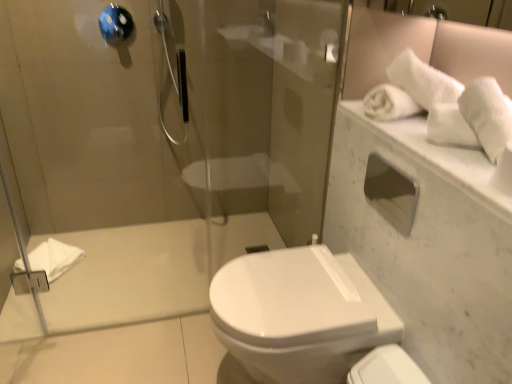
The image size is (512, 384). What are the coordinates of `free space above white glossy bidet at center (from a real-world perspective)` in the screenshot? It's located at (265, 291).